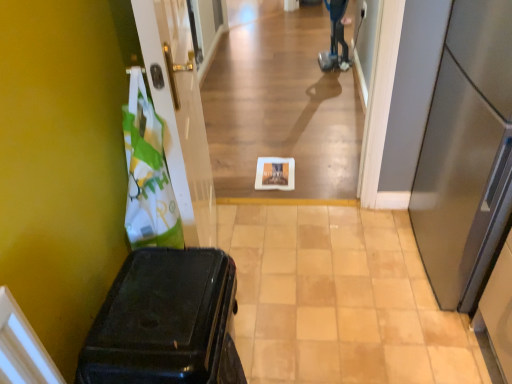
Question: Visually, is blue plastic mobility scooter at upper center positioned to the left or to the right of white glossy plate at center?

Choices:
 (A) left
 (B) right

Answer: (B)

Question: From their relative heights in the image, would you say blue plastic mobility scooter at upper center is taller or shorter than white glossy plate at center?

Choices:
 (A) tall
 (B) short

Answer: (A)

Question: Which object is positioned farthest from the shiny black suitcase at left?

Choices:
 (A) white glossy door at left, which appears as the 1th door when viewed from the left
 (B) white paper at center
 (C) white glossy plate at center
 (D) blue plastic mobility scooter at upper center
 (E) satin silver refrigerator at right, the second door when ordered from left to right

Answer: (D)

Question: Which object is the farthest from the white glossy plate at center?

Choices:
 (A) shiny black suitcase at left
 (B) blue plastic mobility scooter at upper center
 (C) satin silver refrigerator at right, the second door when ordered from left to right
 (D) white paper at center
 (E) white glossy door at left, which is the 2th door from right to left

Answer: (B)